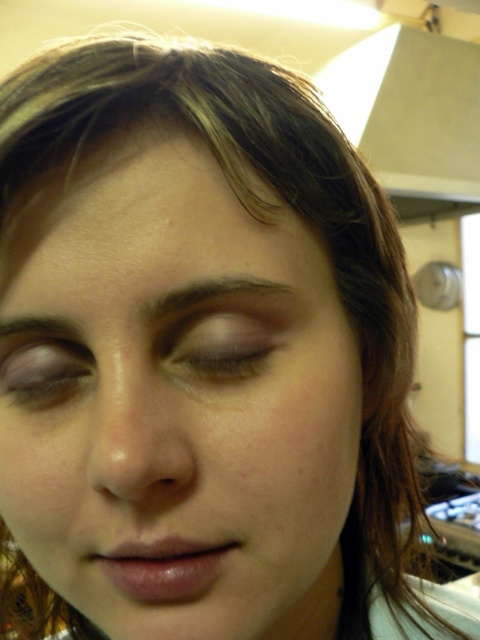
Question: Observing the image, what is the correct spatial positioning of smooth skin face at center in reference to matte brown eye at lower left?

Choices:
 (A) above
 (B) below

Answer: (B)

Question: Among these points, which one is nearest to the camera?

Choices:
 (A) (84, 339)
 (B) (49, 358)
 (C) (278, 316)

Answer: (C)

Question: From the image, what is the correct spatial relationship of matte brown eye at center in relation to dark brown hair at upper center?

Choices:
 (A) right
 (B) left

Answer: (B)

Question: Does smooth skin face at center come behind dark brown hair at upper center?

Choices:
 (A) no
 (B) yes

Answer: (A)

Question: Which is farther from the smooth skin face at center?

Choices:
 (A) matte brown eye at lower left
 (B) dark brown hair at upper center
 (C) dark brown eyebrow at upper left

Answer: (C)

Question: Among these objects, which one is nearest to the camera?

Choices:
 (A) dark brown eyebrow at upper left
 (B) matte brown eye at center
 (C) smooth skin face at center
 (D) dark brown hair at upper center

Answer: (C)